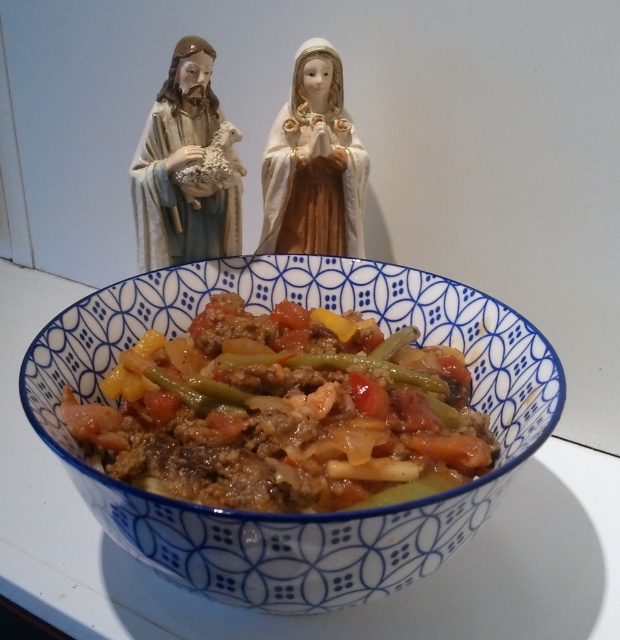
Question: Does matte porcelain figurine at upper left appear under porcelain doll at upper center?

Choices:
 (A) yes
 (B) no

Answer: (A)

Question: Which is farther from the matte porcelain figurine at upper left?

Choices:
 (A) porcelain doll at upper center
 (B) blue ceramic bowl at center

Answer: (B)

Question: Which object appears closest to the camera in this image?

Choices:
 (A) matte porcelain figurine at upper left
 (B) blue ceramic bowl at center

Answer: (B)

Question: Does blue ceramic bowl at center come behind matte porcelain figurine at upper left?

Choices:
 (A) yes
 (B) no

Answer: (B)

Question: Which object is positioned closest to the blue ceramic bowl at center?

Choices:
 (A) matte porcelain figurine at upper left
 (B) porcelain doll at upper center

Answer: (A)

Question: From the image, what is the correct spatial relationship of blue ceramic bowl at center in relation to porcelain doll at upper center?

Choices:
 (A) below
 (B) above

Answer: (A)